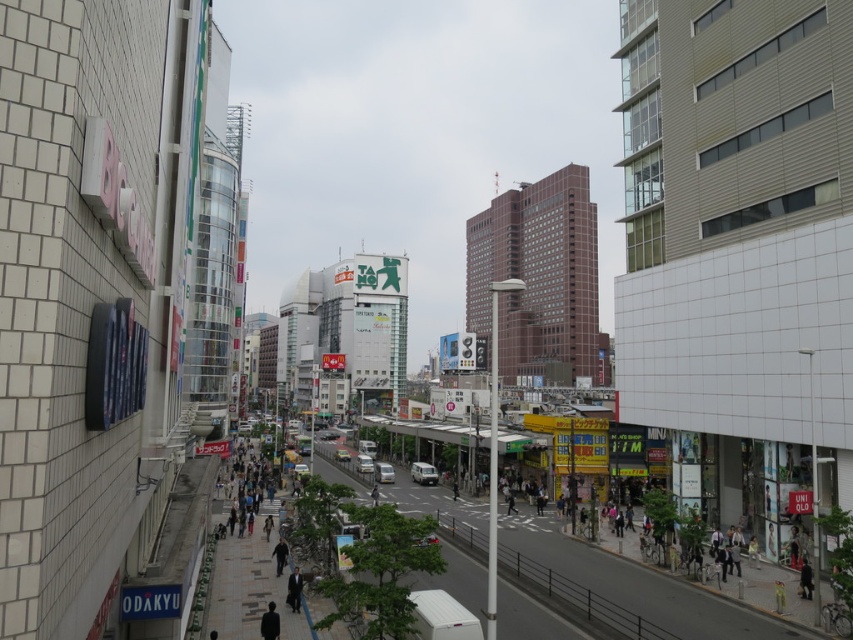
Question: Can you confirm if dark gray suit at lower center is bigger than dark gray suit at center?

Choices:
 (A) yes
 (B) no

Answer: (B)

Question: Is dark gray suit at lower center below dark gray suit at center?

Choices:
 (A) no
 (B) yes

Answer: (A)

Question: Among these points, which one is farthest from the camera?

Choices:
 (A) (260, 616)
 (B) (289, 577)

Answer: (B)

Question: Does dark gray suit at lower center lie in front of dark gray suit at center?

Choices:
 (A) yes
 (B) no

Answer: (A)

Question: Which of the following is the farthest from the observer?

Choices:
 (A) (289, 602)
 (B) (260, 628)

Answer: (A)